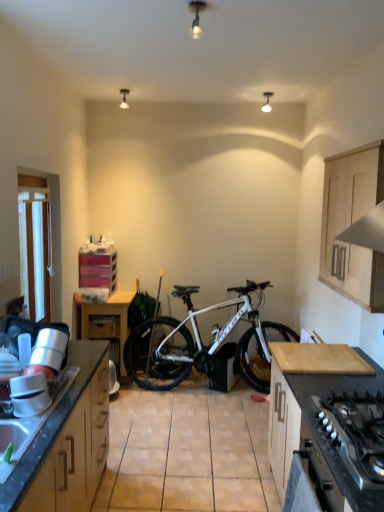
Where is `free location in front of white matte bicycle at center`? This screenshot has height=512, width=384. free location in front of white matte bicycle at center is located at coordinates (203, 438).